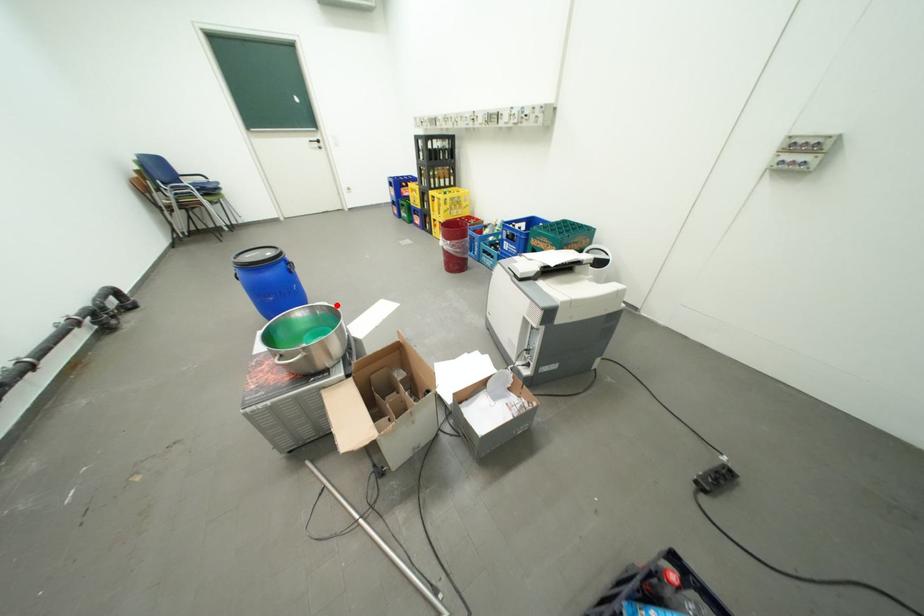
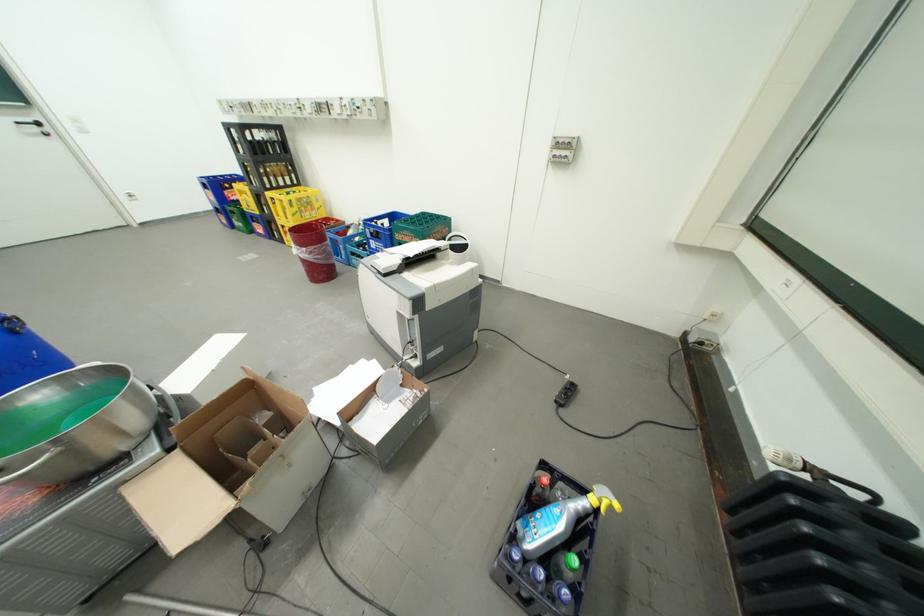
Question: I am providing you with two images of the same scene from different viewpoints. Given a red point in image1, look at the same physical point in image2. Is it:

Choices:
 (A) Closer to the viewpoint
 (B) Farther from the viewpoint

Answer: (B)